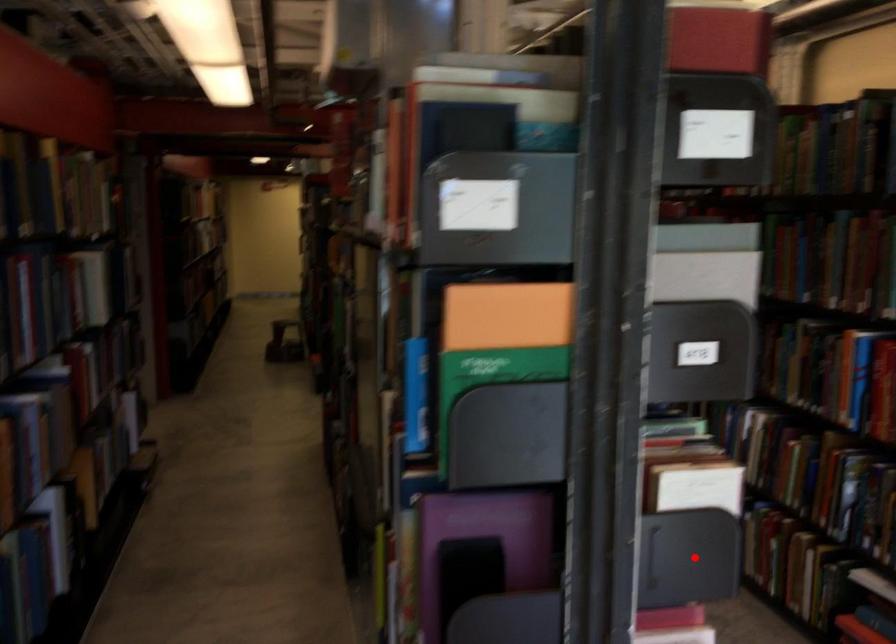
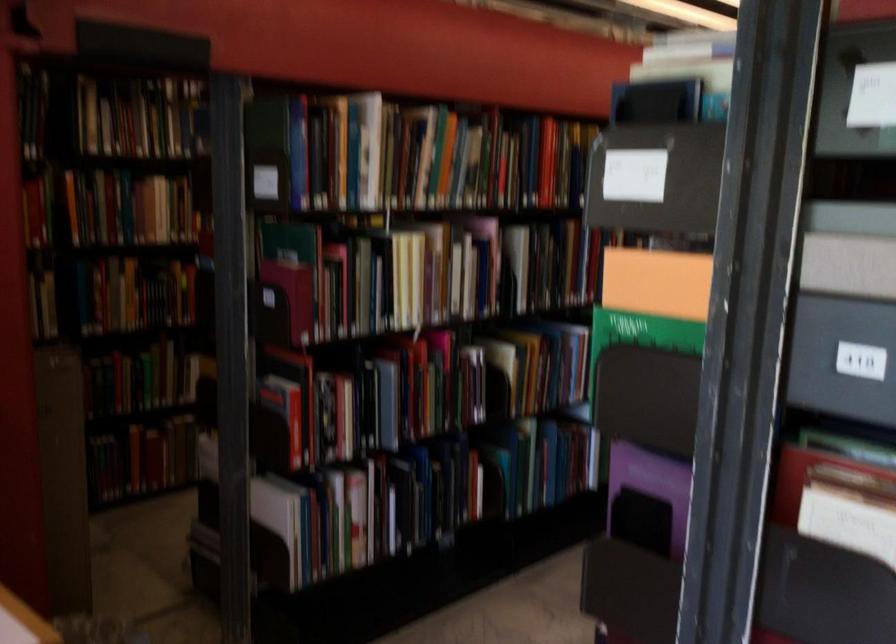
Locate, in the second image, the point that corresponds to the highlighted location in the first image.

(864, 611)